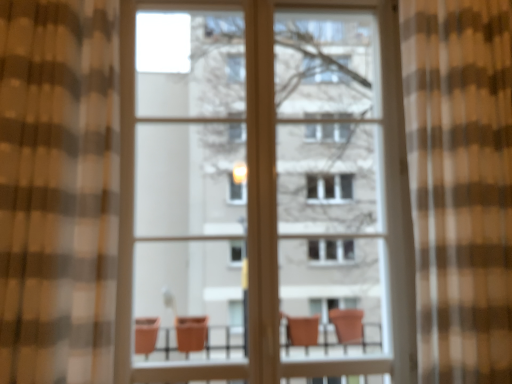
Question: Should I look upward or downward to see brown checkered curtain at left, which is the 1th curtain from left to right?

Choices:
 (A) up
 (B) down

Answer: (A)

Question: Could you tell me if brown checkered curtain at left, which is the 1th curtain from left to right, is turned towards brown sheer curtain at right, marked as the first curtain in a right-to-left arrangement?

Choices:
 (A) yes
 (B) no

Answer: (B)

Question: Can you confirm if brown checkered curtain at left, which is the 1th curtain from left to right, is thinner than brown sheer curtain at right, placed as the second curtain when sorted from left to right?

Choices:
 (A) no
 (B) yes

Answer: (B)

Question: From the image's perspective, is brown checkered curtain at left, which is the 1th curtain from left to right, under brown sheer curtain at right, marked as the first curtain in a right-to-left arrangement?

Choices:
 (A) yes
 (B) no

Answer: (A)

Question: Can you confirm if brown checkered curtain at left, which is the 1th curtain from left to right, is taller than brown sheer curtain at right, placed as the second curtain when sorted from left to right?

Choices:
 (A) no
 (B) yes

Answer: (A)

Question: Does brown checkered curtain at left, which ranks as the second curtain in right-to-left order, touch brown sheer curtain at right, placed as the second curtain when sorted from left to right?

Choices:
 (A) no
 (B) yes

Answer: (A)

Question: Can you confirm if brown checkered curtain at left, which is the 1th curtain from left to right, is positioned to the right of brown sheer curtain at right, placed as the second curtain when sorted from left to right?

Choices:
 (A) yes
 (B) no

Answer: (B)

Question: Are matte glass screen door at center and brown sheer curtain at right, marked as the first curtain in a right-to-left arrangement, located far from each other?

Choices:
 (A) yes
 (B) no

Answer: (A)

Question: Does matte glass screen door at center turn towards brown sheer curtain at right, placed as the second curtain when sorted from left to right?

Choices:
 (A) no
 (B) yes

Answer: (A)

Question: Can you confirm if matte glass screen door at center is taller than brown sheer curtain at right, placed as the second curtain when sorted from left to right?

Choices:
 (A) no
 (B) yes

Answer: (B)

Question: Does matte glass screen door at center lie behind brown sheer curtain at right, placed as the second curtain when sorted from left to right?

Choices:
 (A) yes
 (B) no

Answer: (A)

Question: From a real-world perspective, is matte glass screen door at center physically above brown sheer curtain at right, placed as the second curtain when sorted from left to right?

Choices:
 (A) no
 (B) yes

Answer: (B)

Question: Is matte glass screen door at center positioned with its back to brown sheer curtain at right, marked as the first curtain in a right-to-left arrangement?

Choices:
 (A) yes
 (B) no

Answer: (B)

Question: Is brown sheer curtain at right, marked as the first curtain in a right-to-left arrangement, facing away from matte glass screen door at center?

Choices:
 (A) yes
 (B) no

Answer: (B)